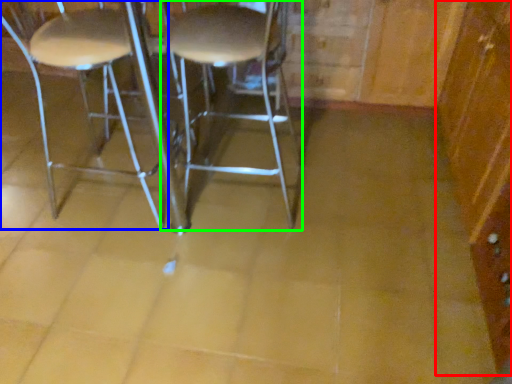
Question: Based on their relative distances, which object is nearer to dresser (highlighted by a red box)? Choose from chair (highlighted by a blue box) and stool (highlighted by a green box).

Choices:
 (A) chair
 (B) stool

Answer: (B)